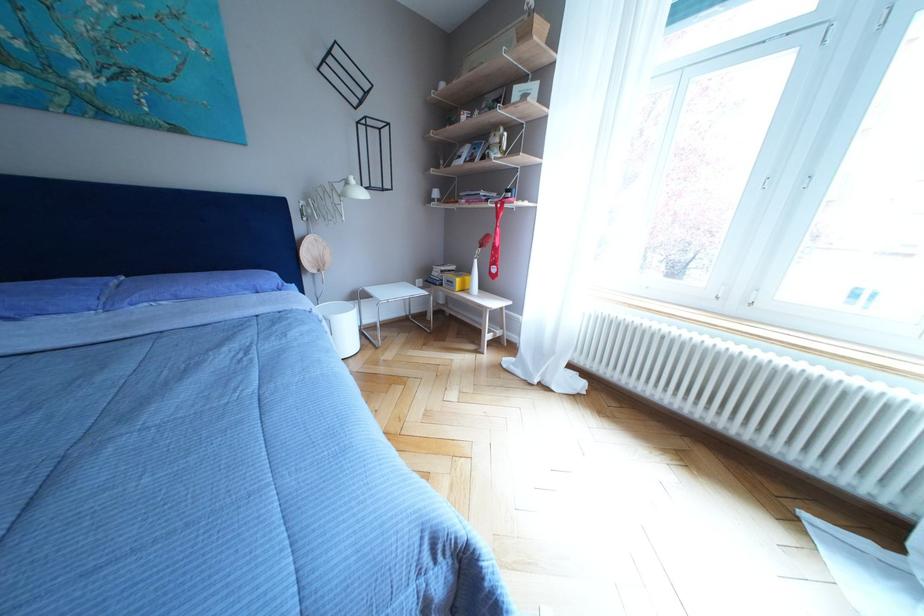
The image size is (924, 616). Find the location of `white vase`. white vase is located at coordinates (473, 277).